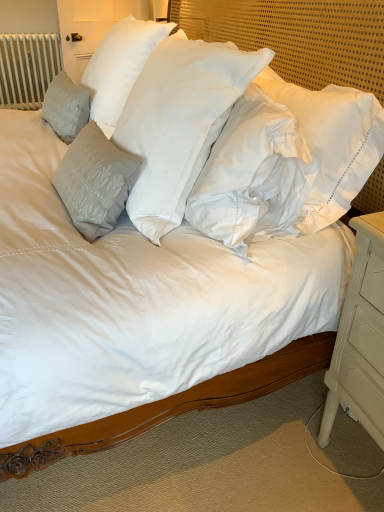
Describe the element at coordinates (27, 68) in the screenshot. The width and height of the screenshot is (384, 512). I see `white painted metal radiator at upper left` at that location.

Image resolution: width=384 pixels, height=512 pixels. What do you see at coordinates (298, 36) in the screenshot?
I see `white textured fabric at upper center` at bounding box center [298, 36].

You are a GUI agent. You are given a task and a screenshot of the screen. Output one action in this format:
    pyautogui.click(x=<x>, y=<y>)
    Task: Click on the white cotton pillow at center, arranged as the 1th pillow when viewed from the right
    Image resolution: width=384 pixels, height=512 pixels.
    Given the screenshot: What is the action you would take?
    point(179,122)

Identify the location of gray textured pillow at left, arranged as the third pillow when viewed from the right. Image resolution: width=384 pixels, height=512 pixels. (66, 106).

Considering the relative sizes of satin gray pillow at left, the 2th pillow positioned from the right, and white painted metal radiator at upper left in the image provided, is satin gray pillow at left, the 2th pillow positioned from the right, bigger than white painted metal radiator at upper left?

Yes, satin gray pillow at left, the 2th pillow positioned from the right, is bigger than white painted metal radiator at upper left.

Considering the sizes of satin gray pillow at left, the 2th pillow viewed from the left, and white painted metal radiator at upper left in the image, is satin gray pillow at left, the 2th pillow viewed from the left, wider or thinner than white painted metal radiator at upper left?

satin gray pillow at left, the 2th pillow viewed from the left, is wider than white painted metal radiator at upper left.

In the scene shown: Is satin gray pillow at left, the 2th pillow positioned from the right, positioned behind white painted metal radiator at upper left?

No, satin gray pillow at left, the 2th pillow positioned from the right, is closer to the viewer.

From a real-world perspective, who is located lower, white painted metal radiator at upper left or white textured fabric at upper center?

From a 3D spatial view, white painted metal radiator at upper left is below.

Consider the image. Is white painted metal radiator at upper left behind white textured fabric at upper center?

Yes, white painted metal radiator at upper left is further from the viewer.

In the scene shown: Between white painted metal radiator at upper left and white textured fabric at upper center, which one appears on the right side from the viewer's perspective?

white textured fabric at upper center.

How far apart are white painted metal radiator at upper left and white textured fabric at upper center?

A distance of 9.45 feet exists between white painted metal radiator at upper left and white textured fabric at upper center.

Considering the relative positions of gray textured pillow at left, which ranks as the 1th pillow in left-to-right order, and white painted wood nightstand at lower right in the image provided, is gray textured pillow at left, which ranks as the 1th pillow in left-to-right order, to the left of white painted wood nightstand at lower right from the viewer's perspective?

Correct, you'll find gray textured pillow at left, which ranks as the 1th pillow in left-to-right order, to the left of white painted wood nightstand at lower right.

Can you tell me how much gray textured pillow at left, which ranks as the 1th pillow in left-to-right order, and white painted wood nightstand at lower right differ in facing direction?

The angle between the facing direction of gray textured pillow at left, which ranks as the 1th pillow in left-to-right order, and the facing direction of white painted wood nightstand at lower right is 1.05 degrees.

The image size is (384, 512). I want to click on nightstand located in front of the gray textured pillow at left, arranged as the third pillow when viewed from the right, so click(360, 337).

In the scene shown: Who is taller, white painted metal radiator at upper left or white cotton pillow at center, arranged as the 1th pillow when viewed from the right?

white painted metal radiator at upper left.

From a real-world perspective, is white painted metal radiator at upper left beneath white cotton pillow at center, arranged as the 1th pillow when viewed from the right?

Yes.

Are white painted metal radiator at upper left and white cotton pillow at center, acting as the 3th pillow starting from the left, far apart?

Yes, white painted metal radiator at upper left and white cotton pillow at center, acting as the 3th pillow starting from the left, are located far from each other.

Which point is more distant from viewer, (196, 163) or (323, 50)?

Positioned behind is point (323, 50).

Is white cotton pillow at center, arranged as the 1th pillow when viewed from the right, positioned with its back to white textured fabric at upper center?

Yes.

In terms of height, does white cotton pillow at center, arranged as the 1th pillow when viewed from the right, look taller or shorter compared to white textured fabric at upper center?

Considering their sizes, white cotton pillow at center, arranged as the 1th pillow when viewed from the right, has less height than white textured fabric at upper center.

Between gray textured pillow at left, arranged as the third pillow when viewed from the right, and white painted metal radiator at upper left, which one has smaller width?

gray textured pillow at left, arranged as the third pillow when viewed from the right.

Can we say gray textured pillow at left, which ranks as the 1th pillow in left-to-right order, lies outside white painted metal radiator at upper left?

Yes, gray textured pillow at left, which ranks as the 1th pillow in left-to-right order, is located beyond the bounds of white painted metal radiator at upper left.

Considering the sizes of gray textured pillow at left, which ranks as the 1th pillow in left-to-right order, and white painted metal radiator at upper left in the image, is gray textured pillow at left, which ranks as the 1th pillow in left-to-right order, bigger or smaller than white painted metal radiator at upper left?

In the image, gray textured pillow at left, which ranks as the 1th pillow in left-to-right order, appears to be smaller than white painted metal radiator at upper left.

Which point is more forward, [69,138] or [36,106]?

Point [69,138]

Which object is further away from the camera, white textured fabric at upper center or gray textured pillow at left, which ranks as the 1th pillow in left-to-right order?

Positioned behind is gray textured pillow at left, which ranks as the 1th pillow in left-to-right order.

From the picture: Is white textured fabric at upper center in contact with gray textured pillow at left, which ranks as the 1th pillow in left-to-right order?

No.

From a real-world perspective, between white textured fabric at upper center and gray textured pillow at left, which ranks as the 1th pillow in left-to-right order, who is vertically lower?

gray textured pillow at left, which ranks as the 1th pillow in left-to-right order, is physically lower.

Consider the image. From their relative heights in the image, would you say white textured fabric at upper center is taller or shorter than gray textured pillow at left, which ranks as the 1th pillow in left-to-right order?

Considering their sizes, white textured fabric at upper center has more height than gray textured pillow at left, which ranks as the 1th pillow in left-to-right order.

Find the location of `the 2nd pillow in front of the white painted metal radiator at upper left, starting your count from the anchor`. the 2nd pillow in front of the white painted metal radiator at upper left, starting your count from the anchor is located at coordinates (120, 66).

The image size is (384, 512). What are the coordinates of `headboard above the white painted metal radiator at upper left (from a real-world perspective)` in the screenshot? It's located at (298, 36).

Estimate the real-world distances between objects in this image. Which object is closer to satin gray pillow at left, the 2th pillow viewed from the left, gray textured pillow at left, which ranks as the 1th pillow in left-to-right order, or white cotton pillow at center, acting as the 3th pillow starting from the left?

gray textured pillow at left, which ranks as the 1th pillow in left-to-right order, is closer to satin gray pillow at left, the 2th pillow viewed from the left.

Looking at the image, which one is located closer to white painted wood nightstand at lower right, satin gray pillow at left, the 2th pillow viewed from the left, or white painted metal radiator at upper left?

satin gray pillow at left, the 2th pillow viewed from the left, lies closer to white painted wood nightstand at lower right than the other object.

Looking at the image, which one is located further to white textured fabric at upper center, gray textured pillow at left, arranged as the third pillow when viewed from the right, or white cotton pillow at center, acting as the 3th pillow starting from the left?

gray textured pillow at left, arranged as the third pillow when viewed from the right, is further to white textured fabric at upper center.

When comparing their distances from white cotton pillow at center, acting as the 3th pillow starting from the left, does white textured fabric at upper center or white painted metal radiator at upper left seem closer?

Based on the image, white textured fabric at upper center appears to be nearer to white cotton pillow at center, acting as the 3th pillow starting from the left.

From the image, which object appears to be farther from white painted wood nightstand at lower right, white cotton pillow at center, acting as the 3th pillow starting from the left, or gray textured pillow at left, which ranks as the 1th pillow in left-to-right order?

gray textured pillow at left, which ranks as the 1th pillow in left-to-right order, is positioned further to the anchor white painted wood nightstand at lower right.

Based on their spatial positions, is white painted metal radiator at upper left or white textured fabric at upper center further from white cotton pillow at center, arranged as the 1th pillow when viewed from the right?

Based on the image, white painted metal radiator at upper left appears to be further to white cotton pillow at center, arranged as the 1th pillow when viewed from the right.

Considering their positions, is white painted wood nightstand at lower right positioned further to white cotton pillow at center, arranged as the 1th pillow when viewed from the right, than satin gray pillow at left, the 2th pillow viewed from the left?

white painted wood nightstand at lower right.

From the image, which object appears to be nearer to gray textured pillow at left, which ranks as the 1th pillow in left-to-right order, white painted metal radiator at upper left or white painted wood nightstand at lower right?

white painted wood nightstand at lower right.

This screenshot has height=512, width=384. I want to click on headboard between white painted wood nightstand at lower right and white painted metal radiator at upper left in the front-back direction, so click(298, 36).

The image size is (384, 512). What are the coordinates of `headboard between white cotton pillow at center, acting as the 3th pillow starting from the left, and white painted metal radiator at upper left, along the z-axis` in the screenshot? It's located at (298, 36).

Find the location of `pillow between white textured fabric at upper center and gray textured pillow at left, arranged as the third pillow when viewed from the right, in the front-back direction`. pillow between white textured fabric at upper center and gray textured pillow at left, arranged as the third pillow when viewed from the right, in the front-back direction is located at coordinates (120, 66).

Find the location of a particular element. headboard between white cotton pillow at center, arranged as the 1th pillow when viewed from the right, and white painted wood nightstand at lower right vertically is located at coordinates click(298, 36).